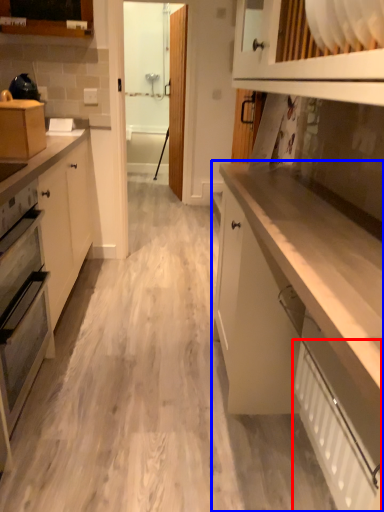
Question: Which point is further to the camera, radiator (highlighted by a red box) or cabinetry (highlighted by a blue box)?

Choices:
 (A) radiator
 (B) cabinetry

Answer: (A)